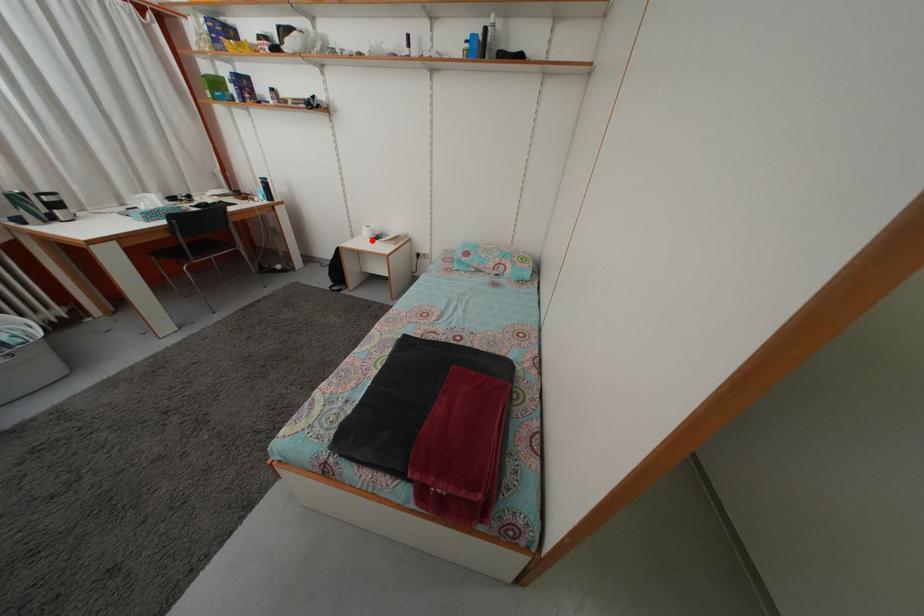
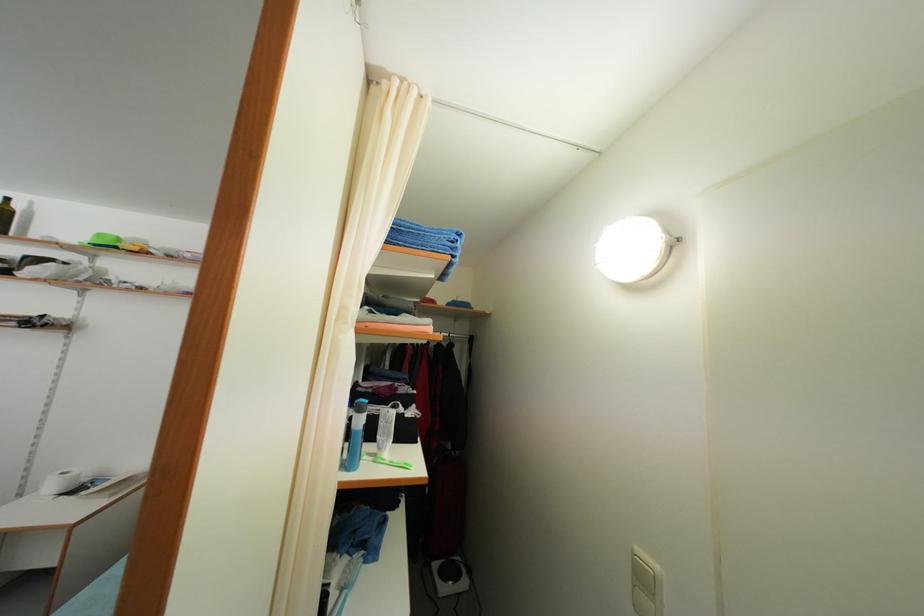
Question: I am providing you with two images of the same scene from different viewpoints. A red point is marked on the first image. At the location where the point appears in image 1, is it still visible in image 2?

Choices:
 (A) Yes
 (B) No

Answer: (A)